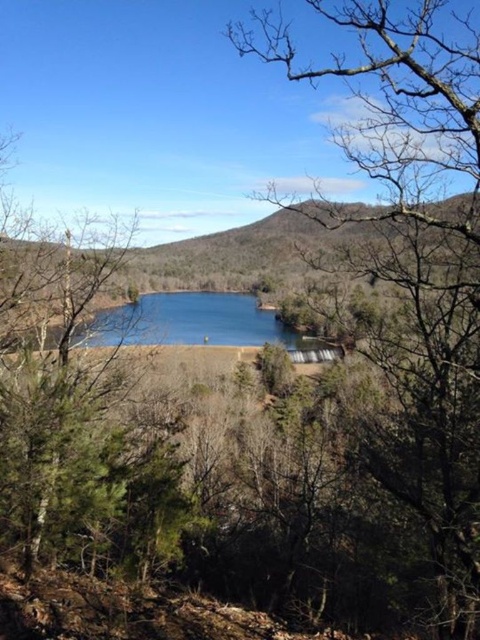
You are a bird flying over the serene landscape scene. You want to land on the blue glass water at center but need to avoid the bare branches at center. Is the distance between them sufficient for you to safely glide from the branches to the water without collision?

The distance between the bare branches at center and blue glass water at center is 31.29 feet, which is sufficient for a bird to glide safely without colliding.

You are an artist setting up your easel to paint the serene lake scene. You want to capture the height comparison between the bare branches at center and the blue glass water at center. Which object should you focus on first if you want to paint from top to bottom?

The bare branches at center is taller than the blue glass water at center, so you should focus on painting the bare branches at center first from top to bottom.

You are standing at the edge of the lake and notice the bare branches at center and the blue glass water at center. Which object is positioned to the right of the other?

The bare branches at center are to the right of the blue glass water at center.